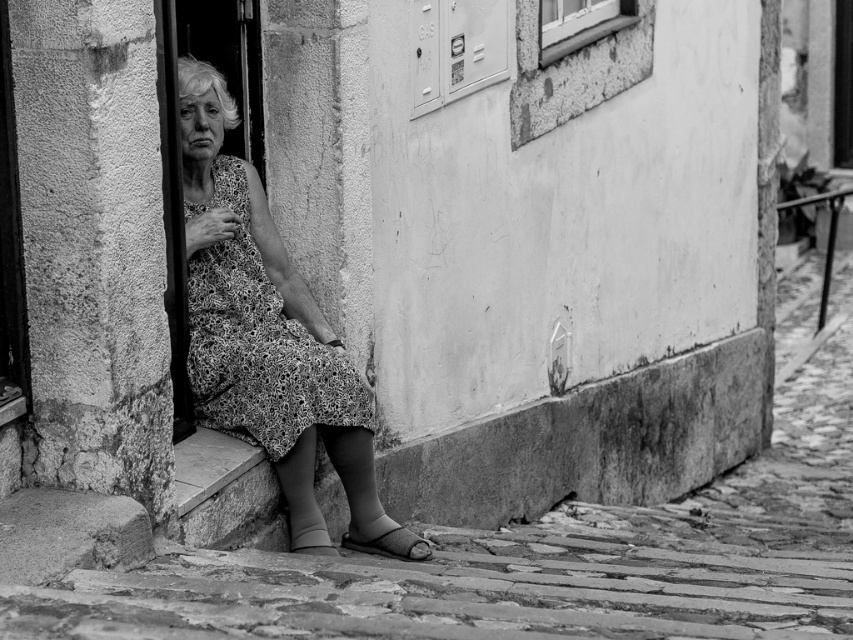
You are standing in front of the doorway where the elderly woman is sitting. You notice two points marked in the scene. Which of these two points, point (254, 417) or point (329, 355), is closer to you?

Point (254, 417) is closer to the camera than point (329, 355), so it is closer to you.